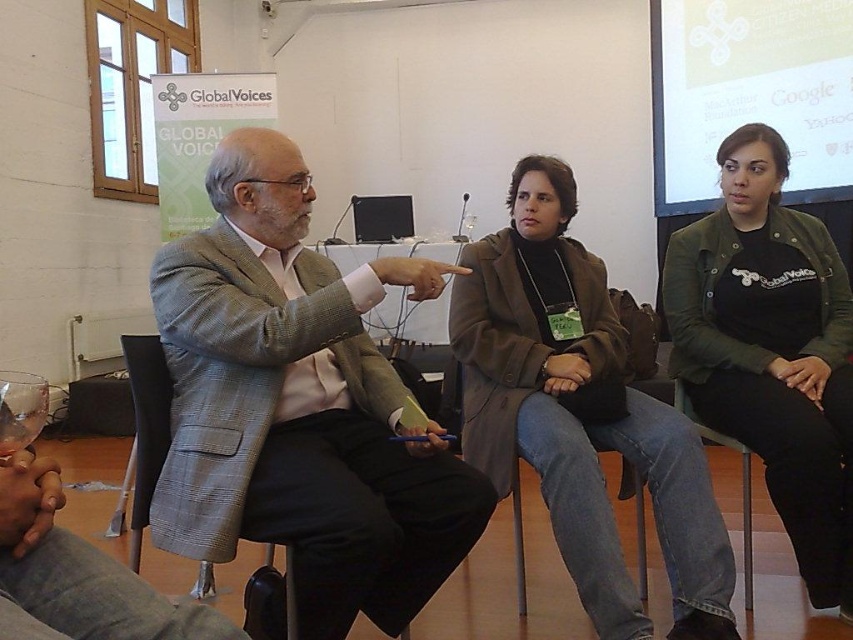
You are an event organizer setting up for a panel discussion. You have a brown textured coat at center and a matte white screen at upper right. Which object is shorter in height?

The brown textured coat at center is shorter in height than the matte white screen at upper right.

You are an event organizer who needs to ensure proper seating arrangements. You see the gray wool suit at center and the gray fabric chair at lower left in the image. Which object is positioned higher in the image?

The gray wool suit at center is positioned higher than the gray fabric chair at lower left in the image.